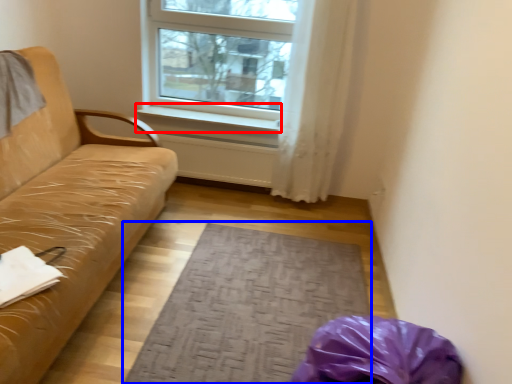
Question: Which object is closer to the camera taking this photo, window sill (highlighted by a red box) or mat (highlighted by a blue box)?

Choices:
 (A) window sill
 (B) mat

Answer: (B)